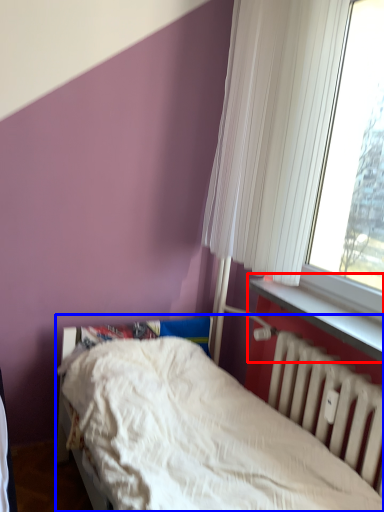
Question: Among these objects, which one is nearest to the camera, window sill (highlighted by a red box) or bed (highlighted by a blue box)?

Choices:
 (A) window sill
 (B) bed

Answer: (B)